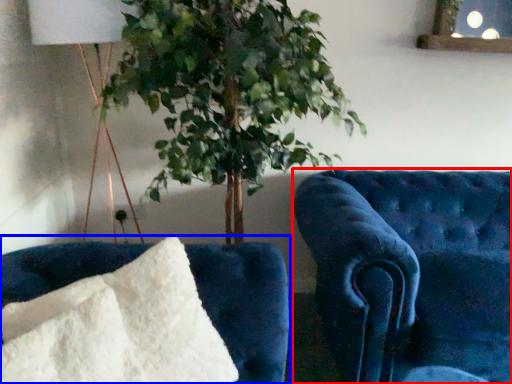
Question: Among these objects, which one is farthest to the camera, furniture (highlighted by a red box) or furniture (highlighted by a blue box)?

Choices:
 (A) furniture
 (B) furniture

Answer: (A)